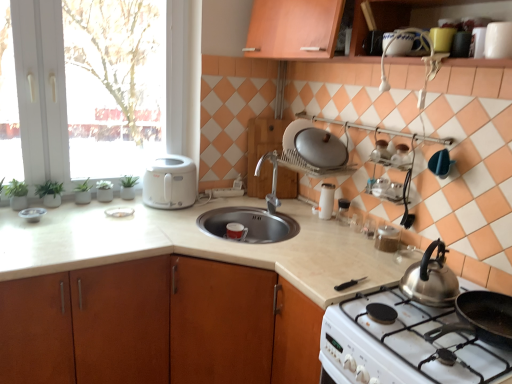
The image size is (512, 384). Find the location of `free space between metallic silver bowl at left, the sixth appliance positioned from the right, and white glossy plate at left, the 3th appliance viewed from the top`. free space between metallic silver bowl at left, the sixth appliance positioned from the right, and white glossy plate at left, the 3th appliance viewed from the top is located at coordinates (76, 212).